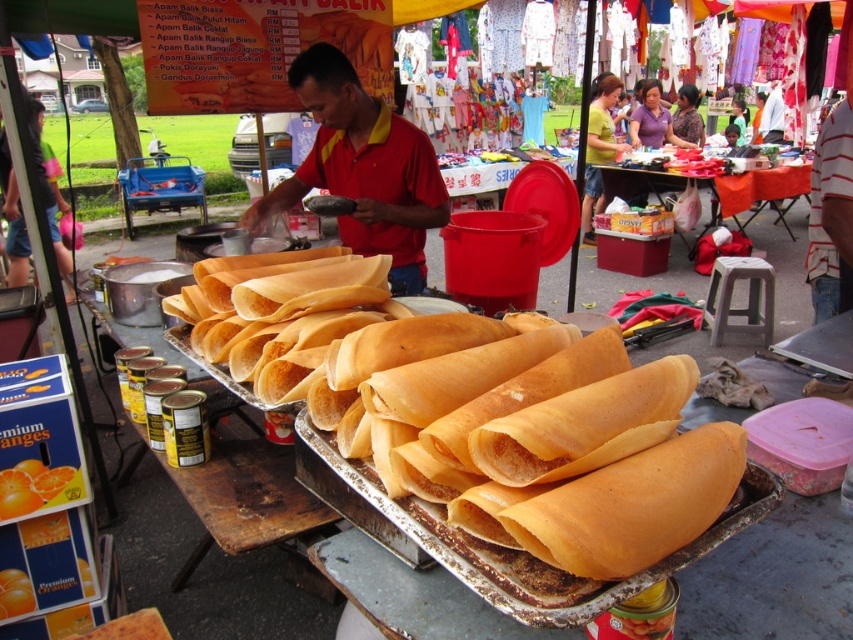
You are a customer at the market and want to buy the golden crispy roti at center and the red matte shirt at center. The vendor tells you that the items you want are arranged in a specific way. Based on their positions, which item is closer to the ground?

The golden crispy roti at center is below the red matte shirt at center, so the golden crispy roti at center is closer to the ground.

You are a customer at the market and want to reach the orange fabric table at center to buy something. However, there is a vendor wearing a red matte shirt at center in your way. Can you walk directly to the table without moving around the vendor?

The red matte shirt at center is in front of the orange fabric table at center, so you cannot walk directly to the table without moving around the vendor.